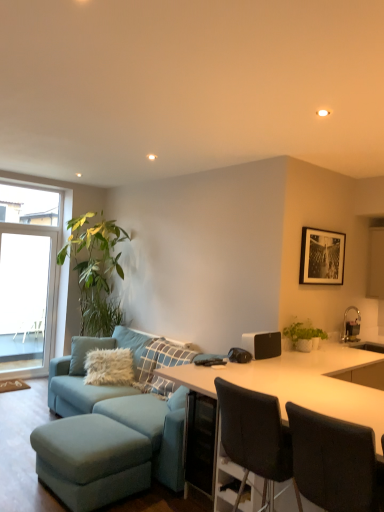
Question: From the image's perspective, is black fabric chair at lower right, the first chair positioned from the back, located above or below white fluffy pillow at center?

Choices:
 (A) below
 (B) above

Answer: (B)

Question: In terms of width, does black fabric chair at lower right, acting as the second chair starting from the front, look wider or thinner when compared to white fluffy pillow at center?

Choices:
 (A) wide
 (B) thin

Answer: (A)

Question: Estimate the real-world distances between objects in this image. Which object is closer to the white glossy desk at center?

Choices:
 (A) green matte plant at right
 (B) matte blue fabric couch at lower left
 (C) white matte speaker at center
 (D) black fabric chair at lower right, the first chair positioned from the back
 (E) white fluffy pillow at center

Answer: (C)

Question: Which object is positioned farthest from the matte blue ottoman at lower left?

Choices:
 (A) black fabric chair at lower right, which is the second chair in back-to-front order
 (B) white matte speaker at center
 (C) matte blue fabric couch at lower left
 (D) white glossy desk at center
 (E) white fluffy pillow at center

Answer: (A)